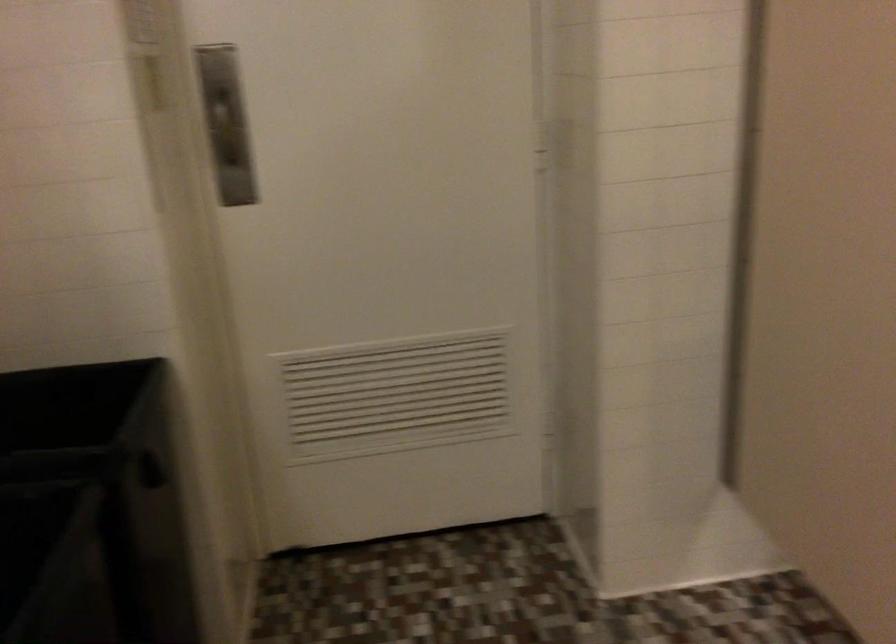
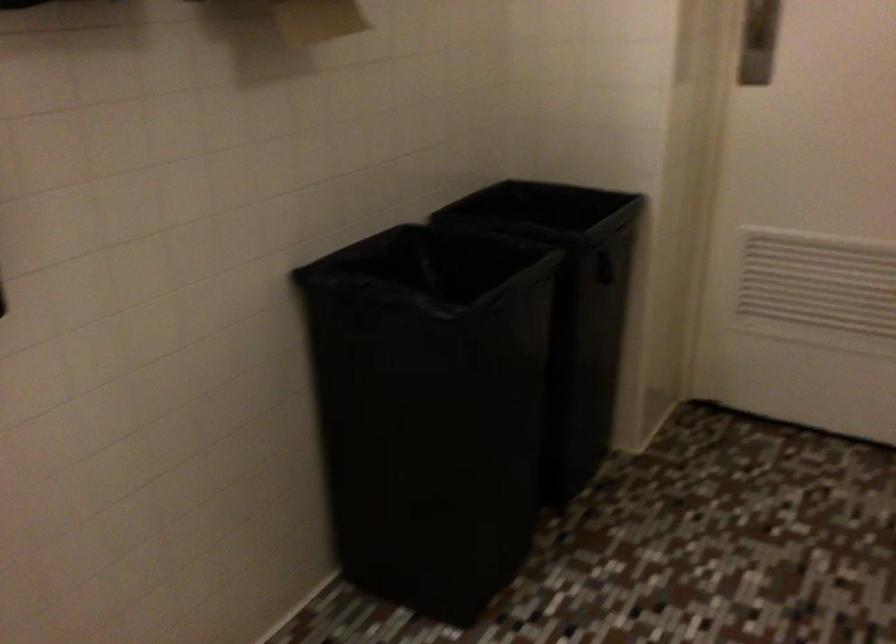
Question: The camera is either moving clockwise (left) or counter-clockwise (right) around the object. The first image is from the beginning of the video and the second image is from the end. Is the camera moving left or right when shooting the video?

Choices:
 (A) Left
 (B) Right

Answer: (B)